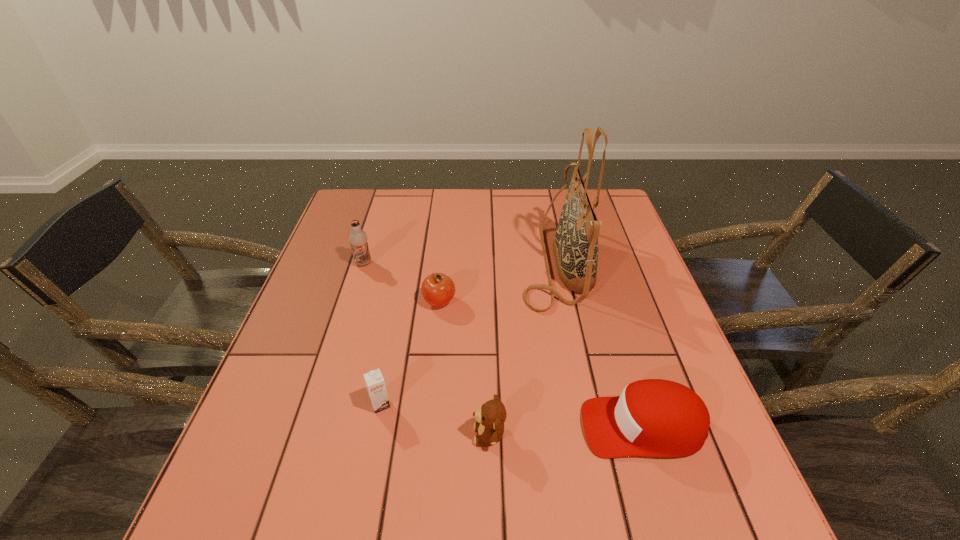
The image size is (960, 540). In order to click on object positioned at the far edge in this screenshot , I will do `click(575, 246)`.

In order to click on object at the left edge in this screenshot , I will do `click(358, 238)`.

Where is `handbag that is at the right edge`? The width and height of the screenshot is (960, 540). handbag that is at the right edge is located at coordinates (x=575, y=246).

Find the location of a particular element. baseball cap at the right edge is located at coordinates tap(653, 417).

At what (x,y) coordinates should I click in order to perform the action: click on object that is at the far right corner. Please return your answer as a coordinate pair (x, y). This screenshot has height=540, width=960. Looking at the image, I should click on (575, 246).

Locate an element on the screen. vacant space at the far edge of the desktop is located at coordinates (461, 207).

This screenshot has width=960, height=540. In the image, there is a desktop. Identify the location of vacant space at the near edge. (428, 495).

Locate an element on the screen. free spot at the left edge of the desktop is located at coordinates point(306,448).

Locate an element on the screen. free space at the right edge of the desktop is located at coordinates (604, 320).

Locate an element on the screen. vacant position at the near left corner of the desktop is located at coordinates (245, 525).